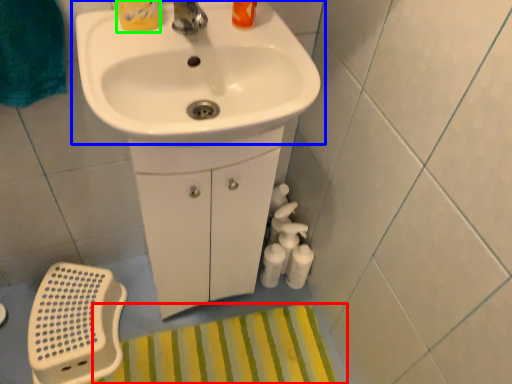
Question: Estimate the real-world distances between objects in this image. Which object is farther from bath mat (highlighted by a red box), sink (highlighted by a blue box) or toiletry (highlighted by a green box)?

Choices:
 (A) sink
 (B) toiletry

Answer: (B)